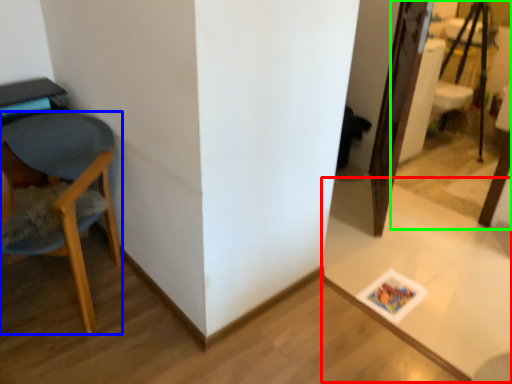
Question: Considering the real-world distances, which object is farthest from table (highlighted by a red box)? chair (highlighted by a blue box) or mirror (highlighted by a green box)?

Choices:
 (A) chair
 (B) mirror

Answer: (B)